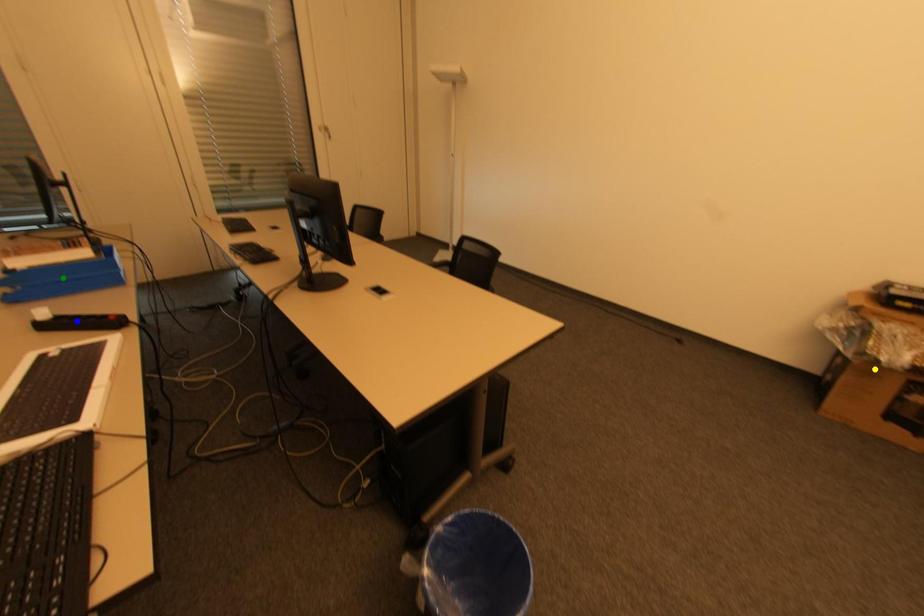
Order these from nearest to farthest:
green point
yellow point
blue point

blue point, green point, yellow point